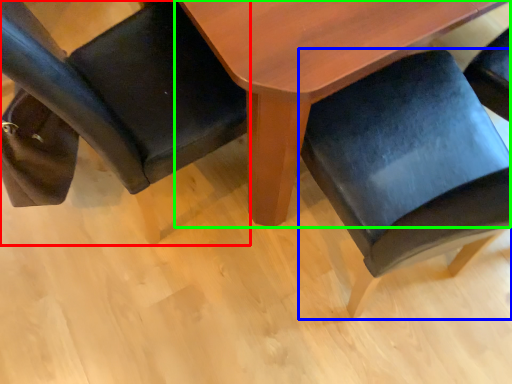
Question: Considering the real-world distances, which object is closest to chair (highlighted by a red box)? chair (highlighted by a blue box) or table (highlighted by a green box).

Choices:
 (A) chair
 (B) table

Answer: (B)